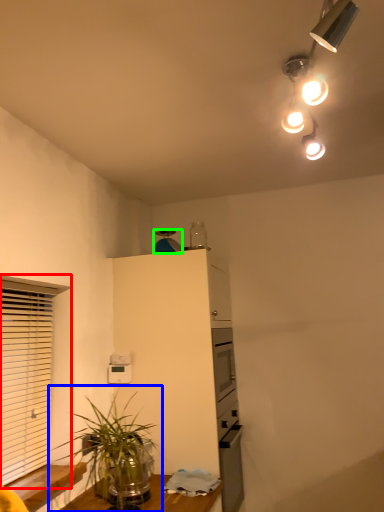
Question: Which is nearer to the window (highlighted by a red box)? houseplant (highlighted by a blue box) or appliance (highlighted by a green box).

Choices:
 (A) houseplant
 (B) appliance

Answer: (A)